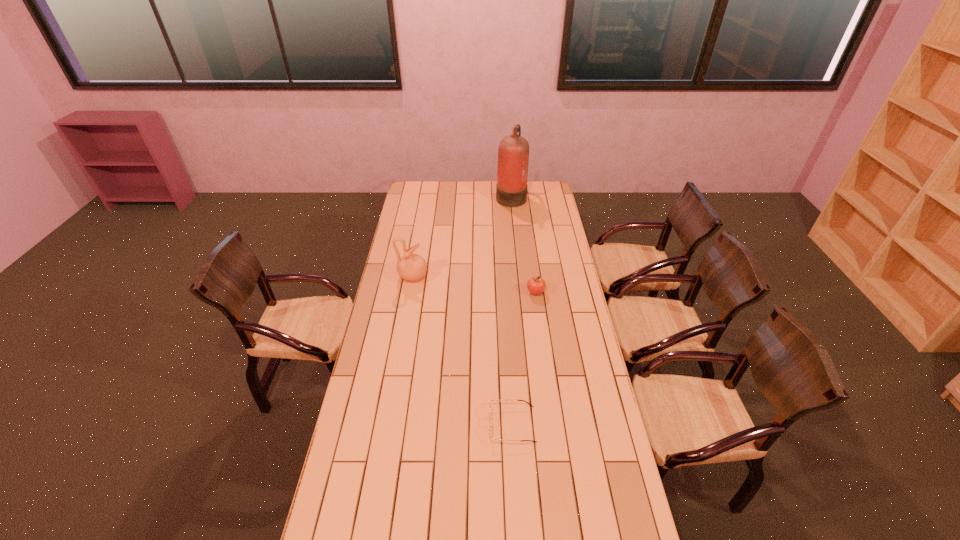
This screenshot has height=540, width=960. Find the location of `unoccupied position between the fire extinguisher and the apple`. unoccupied position between the fire extinguisher and the apple is located at coordinates (523, 244).

Identify the location of vacant space that's between the pottery and the second shortest object. (474, 285).

Identify the location of object that stands as the closest to the second shortest object. (412, 267).

Locate which object ranks in proximity to the pottery. Please provide its 2D coordinates. Your answer should be formatted as a tuple, i.e. [(x, y)], where the tuple contains the x and y coordinates of a point satisfying the conditions above.

[(536, 285)]

Find the location of a particular element. The height and width of the screenshot is (540, 960). vacant area in the image that satisfies the following two spatial constraints: 1. on the spout of the third shortest object; 2. on the back side of the apple is located at coordinates (410, 292).

Locate an element on the screen. Image resolution: width=960 pixels, height=540 pixels. free spot that satisfies the following two spatial constraints: 1. on the back side of the apple; 2. on the spout of the leftmost object is located at coordinates tap(534, 277).

Find the location of a particular element. This screenshot has width=960, height=540. free space that satisfies the following two spatial constraints: 1. on the back side of the second shortest object; 2. at the nozzle of the farthest object is located at coordinates click(x=522, y=196).

Where is `vacant space that satisfies the following two spatial constraints: 1. on the spout of the second tallest object; 2. on the left side of the second shortest object`? vacant space that satisfies the following two spatial constraints: 1. on the spout of the second tallest object; 2. on the left side of the second shortest object is located at coordinates (410, 292).

The image size is (960, 540). Find the location of `free region that satisfies the following two spatial constraints: 1. on the spout of the apple; 2. on the right side of the leftmost object`. free region that satisfies the following two spatial constraints: 1. on the spout of the apple; 2. on the right side of the leftmost object is located at coordinates (410, 292).

Find the location of a particular element. This screenshot has height=540, width=960. free point that satisfies the following two spatial constraints: 1. on the back side of the apple; 2. on the spout of the second tallest object is located at coordinates (534, 277).